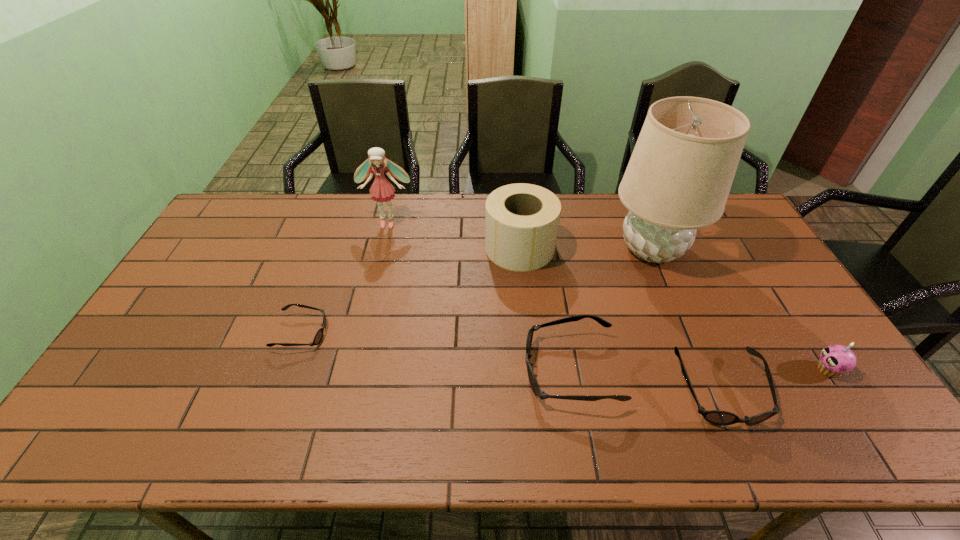
Where is `the shortest object`? This screenshot has height=540, width=960. the shortest object is located at coordinates (318, 337).

I want to click on the leftmost sunglasses, so click(x=318, y=337).

Where is `the second sunglasses from right to left`? the second sunglasses from right to left is located at coordinates click(533, 382).

At what (x,y) coordinates should I click in order to perform the action: click on the second shortest sunglasses. Please return your answer as a coordinate pair (x, y). The image size is (960, 540). Looking at the image, I should click on (717, 417).

Find the location of a particular element. The image size is (960, 540). the rightmost sunglasses is located at coordinates (717, 417).

Image resolution: width=960 pixels, height=540 pixels. Find the location of `doll`. doll is located at coordinates (382, 190).

Locate an element on the screen. This screenshot has width=960, height=540. the sixth object from right to left is located at coordinates (382, 190).

What are the coordinates of `lampshade` in the screenshot? It's located at (678, 179).

At what (x,y) coordinates should I click in order to perform the action: click on toilet tissue. Please return your answer as a coordinate pair (x, y). The image size is (960, 540). Looking at the image, I should click on click(x=521, y=220).

This screenshot has width=960, height=540. Find the location of `cupcake`. cupcake is located at coordinates (835, 360).